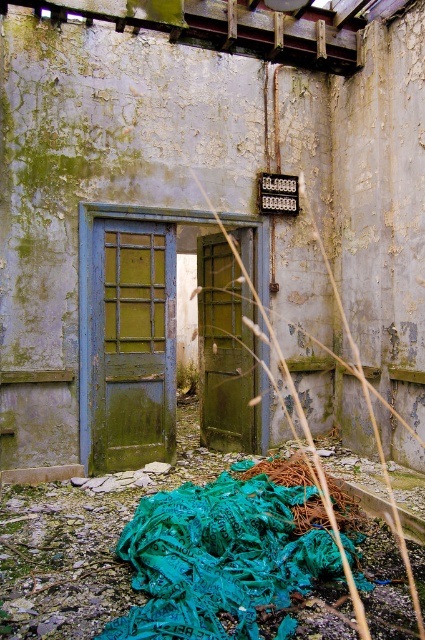
Question: Among these points, which one is farthest from the camera?

Choices:
 (A) (167, 344)
 (B) (255, 410)

Answer: (B)

Question: Does green matte door at left have a smaller size compared to green matte door at center?

Choices:
 (A) no
 (B) yes

Answer: (B)

Question: Can you confirm if green matte door at left is thinner than green matte door at center?

Choices:
 (A) yes
 (B) no

Answer: (B)

Question: Does green matte door at left appear under green matte door at center?

Choices:
 (A) no
 (B) yes

Answer: (A)